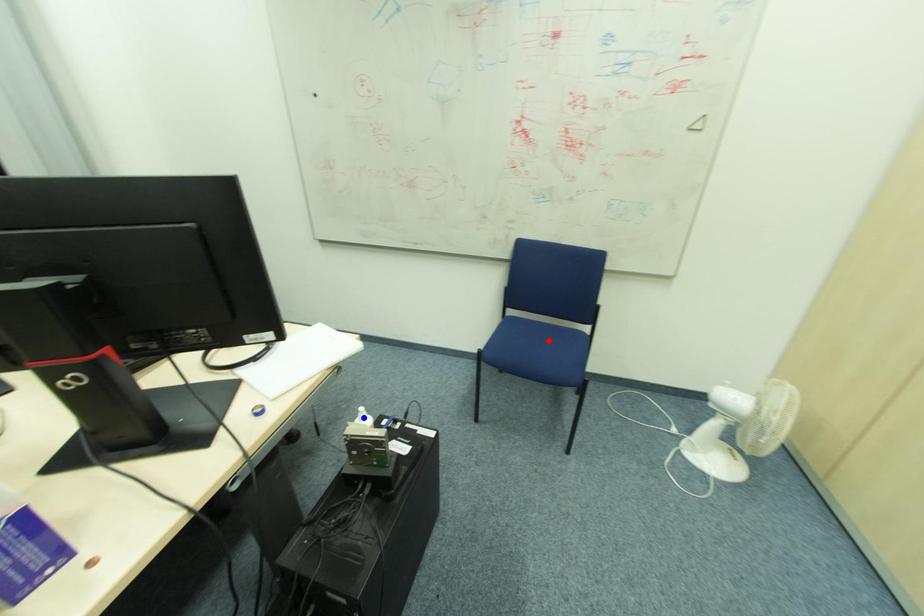
Question: Which of the two points in the image is closer to the camera?

Choices:
 (A) Blue point is closer.
 (B) Red point is closer.

Answer: (B)